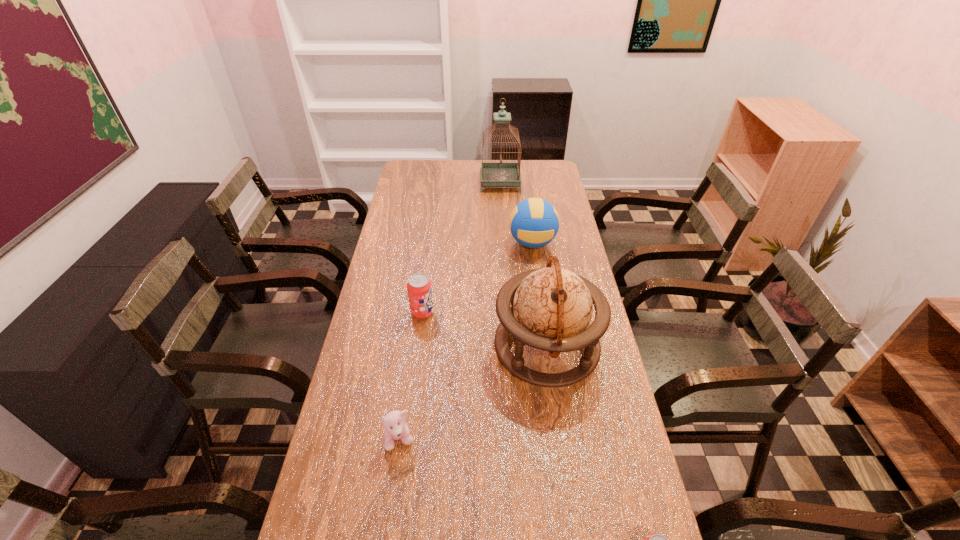
This screenshot has height=540, width=960. I want to click on vacant area situated at the door of the farthest object, so click(424, 181).

Where is `free space located on the front of the globe`? free space located on the front of the globe is located at coordinates (556, 412).

What are the coordinates of `free location located on the left of the volleyball` in the screenshot? It's located at (441, 243).

You are a GUI agent. You are given a task and a screenshot of the screen. Output one action in this format:
    pyautogui.click(x=<x>, y=<y>)
    Task: Click on the vacant space located 0.380m on the surface of the farther soda can
    The height and width of the screenshot is (540, 960).
    Given the screenshot: What is the action you would take?
    [551, 312]

Find the location of `vacant space located 0.120m at the face of the second nearest object`. vacant space located 0.120m at the face of the second nearest object is located at coordinates (391, 505).

Locate an element on the screen. object that is positioned at the far edge is located at coordinates (493, 174).

At what (x,y) coordinates should I click in order to perform the action: click on soda can positioned at the left edge. Please return your answer as a coordinate pair (x, y). Looking at the image, I should click on (419, 287).

Image resolution: width=960 pixels, height=540 pixels. Find the location of `teddy bear present at the left edge`. teddy bear present at the left edge is located at coordinates (395, 428).

This screenshot has height=540, width=960. Identify the location of globe that is at the right edge. pos(551,308).

Identify the location of volleyball that is at the right edge. (534, 222).